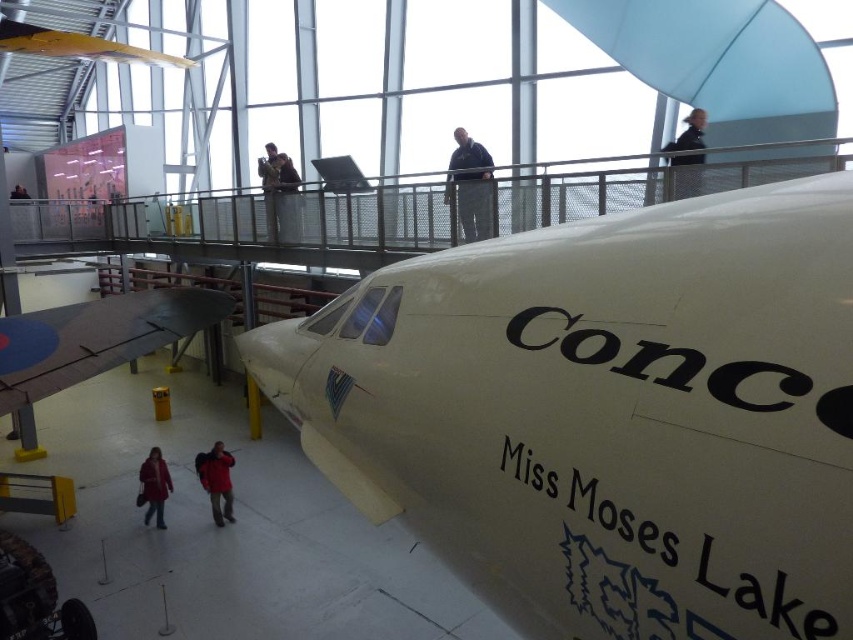
You are standing in the museum and want to take a photo of the Concorde. You have two points marked on your camera screen to focus on. The first point is at point (489, 192) and the second is at point (219, 454). Which point is closer to you?

Point (489, 192) is closer to the viewer than point (219, 454).

You are a tour guide in the aviation museum. You notice two visitors wearing jackets. One is wearing a black leather jacket at upper center, and the other is wearing a red jacket at lower left. Which visitor is shorter in height?

The black leather jacket at upper center has a lesser height compared to the red jacket at lower left, so the visitor wearing the black leather jacket at upper center is shorter.